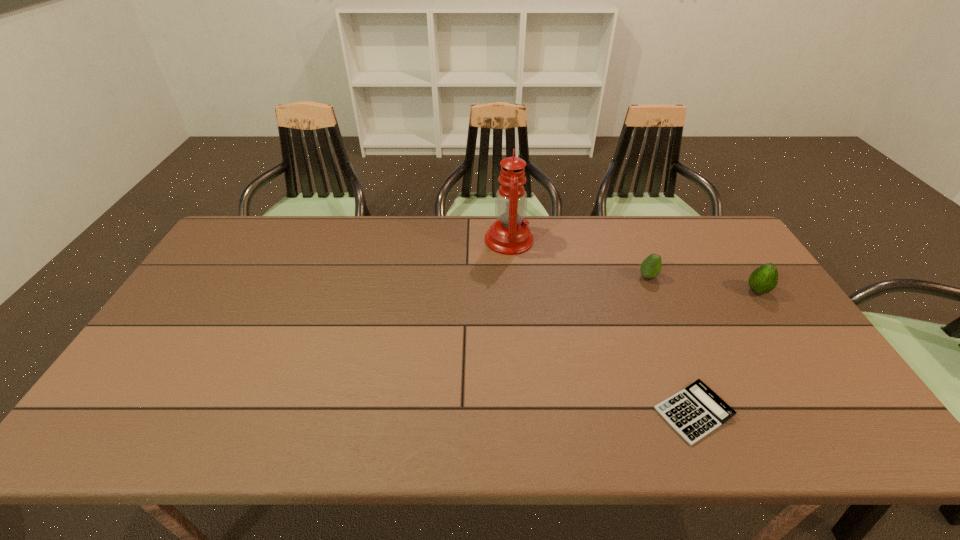
The height and width of the screenshot is (540, 960). I want to click on vacant space that satisfies the following two spatial constraints: 1. on the front side of the second shortest object; 2. on the left side of the rightmost object, so click(x=654, y=291).

Identify the location of free region that satisfies the following two spatial constraints: 1. on the front side of the right avocado; 2. on the right side of the leftmost object. (514, 291).

Identify the location of free spot that satisfies the following two spatial constraints: 1. on the front side of the leftmost object; 2. on the left side of the nearest object. The height and width of the screenshot is (540, 960). (523, 413).